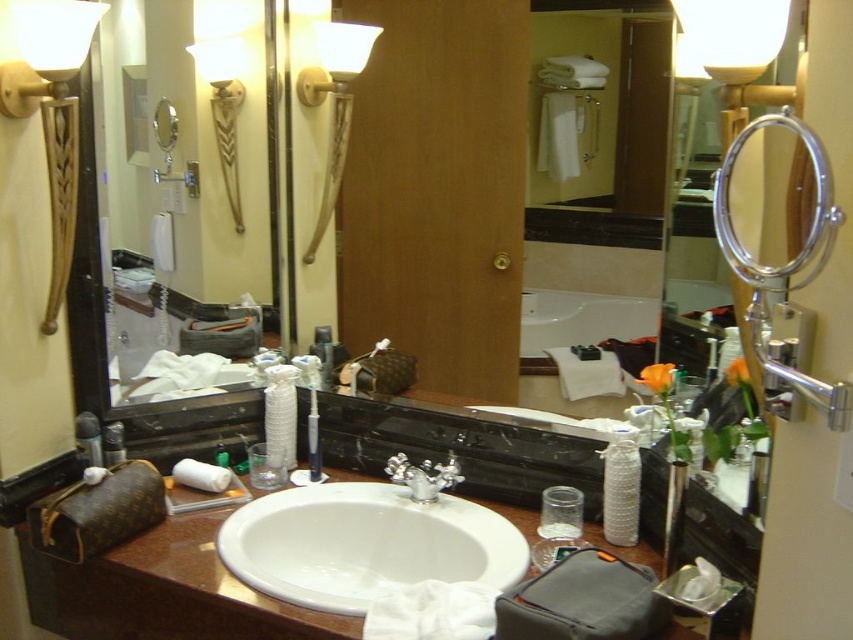
Does matte gold sconce at upper left lie in front of metallic silver canister at left?

Yes, matte gold sconce at upper left is in front of metallic silver canister at left.

Which is in front, point (13, 1) or point (86, 454)?

Point (13, 1)

Is point (13, 90) behind point (96, 428)?

No, (13, 90) is closer to viewer.

Identify the location of matte gold sconce at upper left. The height and width of the screenshot is (640, 853). click(x=51, y=113).

Does brown marble countertop at center have a smaller size compared to white ceramic sink at center?

No.

Does brown marble countertop at center have a greater height compared to white ceramic sink at center?

Correct, brown marble countertop at center is much taller as white ceramic sink at center.

Consider the image. Measure the distance between point [115,568] and camera.

The distance of point [115,568] from camera is 4.17 feet.

Locate an element on the screen. The image size is (853, 640). brown marble countertop at center is located at coordinates (161, 593).

Does point (254, 298) come behind point (96, 20)?

Yes, point (254, 298) is behind point (96, 20).

Between matte black mirror at left and matte gold sconce at upper left, which one is positioned higher?

matte gold sconce at upper left is higher up.

Where is `matte black mirror at left`? The width and height of the screenshot is (853, 640). matte black mirror at left is located at coordinates (175, 188).